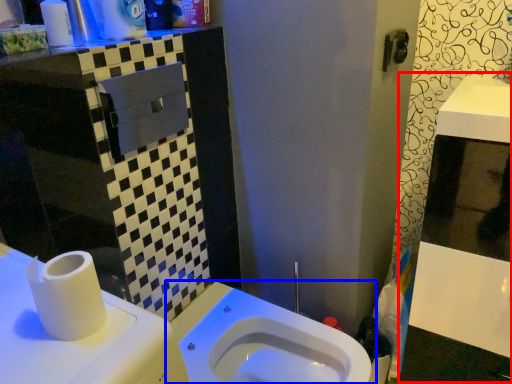
Question: Which object appears farthest to the camera in this image, medicine cabinet (highlighted by a red box) or toilet (highlighted by a blue box)?

Choices:
 (A) medicine cabinet
 (B) toilet

Answer: (B)